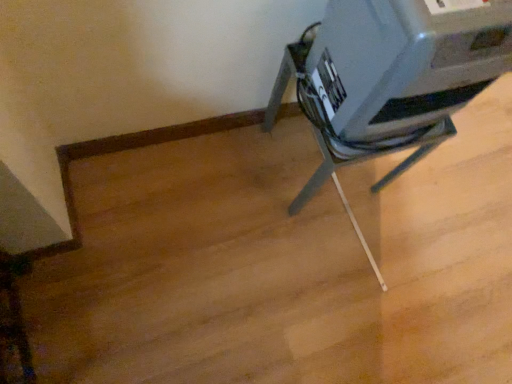
Question: From their relative heights in the image, would you say satin gray printer at upper right is taller or shorter than metallic gray printer at center?

Choices:
 (A) short
 (B) tall

Answer: (A)

Question: Considering their positions, is satin gray printer at upper right located in front of or behind metallic gray printer at center?

Choices:
 (A) front
 (B) behind

Answer: (A)

Question: Looking at their shapes, would you say satin gray printer at upper right is wider or thinner than metallic gray printer at center?

Choices:
 (A) thin
 (B) wide

Answer: (A)

Question: Does point (303, 104) appear closer or farther from the camera than point (468, 59)?

Choices:
 (A) closer
 (B) farther

Answer: (B)

Question: Is metallic gray printer at center taller or shorter than satin gray printer at upper right?

Choices:
 (A) short
 (B) tall

Answer: (B)

Question: From the image's perspective, is metallic gray printer at center above or below satin gray printer at upper right?

Choices:
 (A) below
 (B) above

Answer: (A)

Question: From a real-world perspective, is metallic gray printer at center above or below satin gray printer at upper right?

Choices:
 (A) below
 (B) above

Answer: (A)